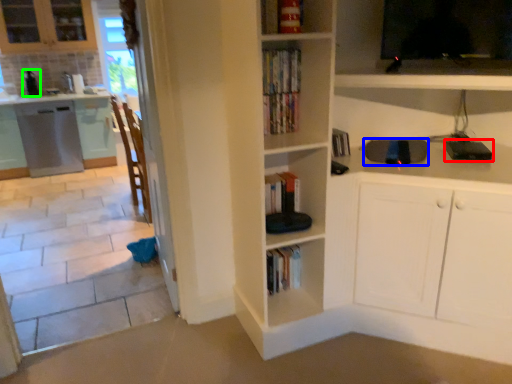
Question: Which object is the closest to the appliance (highlighted by a red box)? Choose among these: appliance (highlighted by a blue box) or appliance (highlighted by a green box).

Choices:
 (A) appliance
 (B) appliance

Answer: (A)